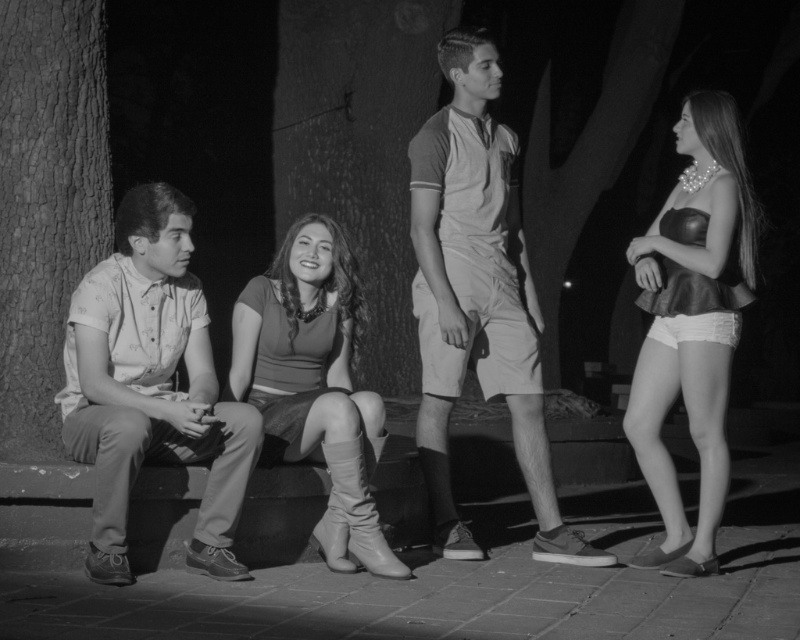
In the black and white photo, you see a light beige shorts at center and a rough bark tree at center. Which object is shorter?

The light beige shorts at center is shorter than the rough bark tree at center.

You are standing at the origin point in the image. Which of the two points, point [32,282] or point [334,268], is farther away from you?

Point [32,282] is behind point [334,268], so it is farther away from you.

You are a photographer trying to capture a portrait of the light beige shorts at center and the rough bark tree at center. Which object is closer to the camera lens?

The light beige shorts at center is positioned under the rough bark tree at center, so the light beige shorts at center is closer to the camera lens.